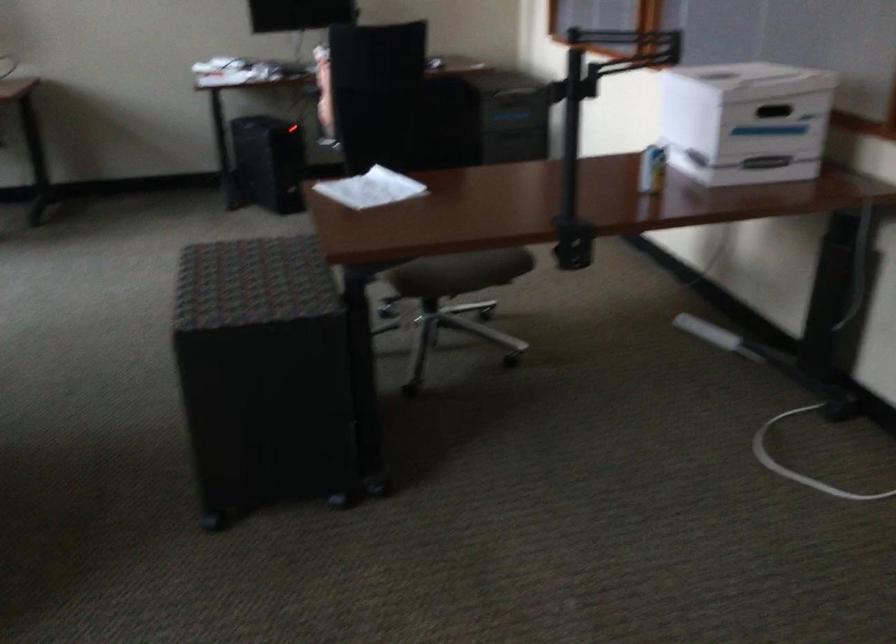
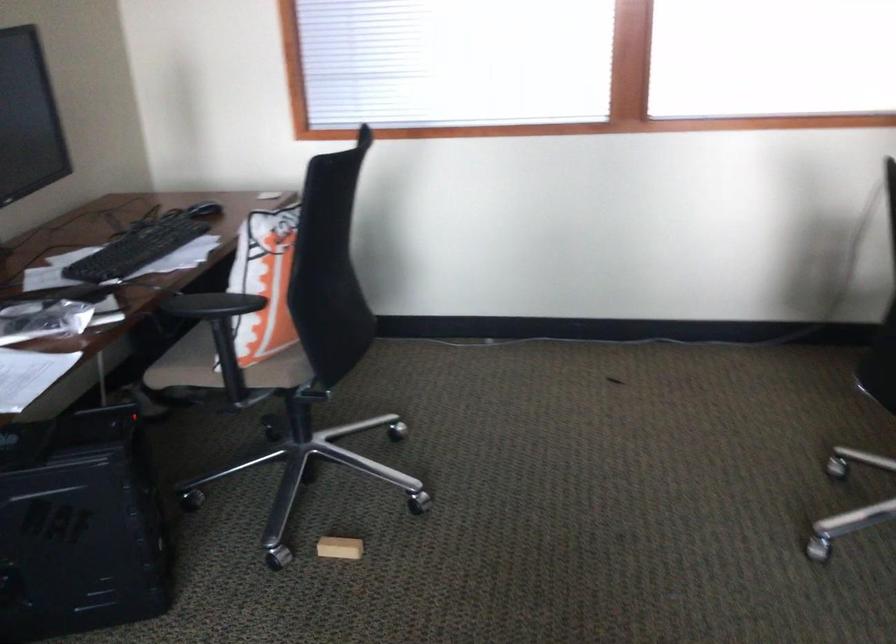
The point at [322,77] is marked in the first image. Where is the corresponding point in the second image?

(211, 305)